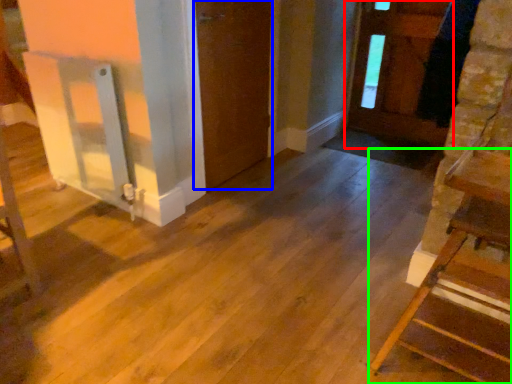
Question: Based on their relative distances, which object is farther from door (highlighted by a red box)? Choose from door (highlighted by a blue box) and furniture (highlighted by a green box).

Choices:
 (A) door
 (B) furniture

Answer: (B)